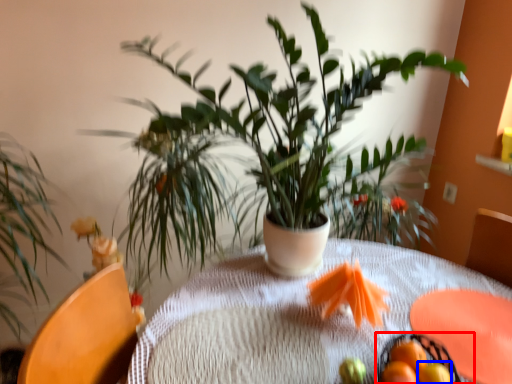
Question: Which of the following is the farthest to the observer, basket (highlighted by a red box) or tangerine (highlighted by a blue box)?

Choices:
 (A) basket
 (B) tangerine

Answer: (B)